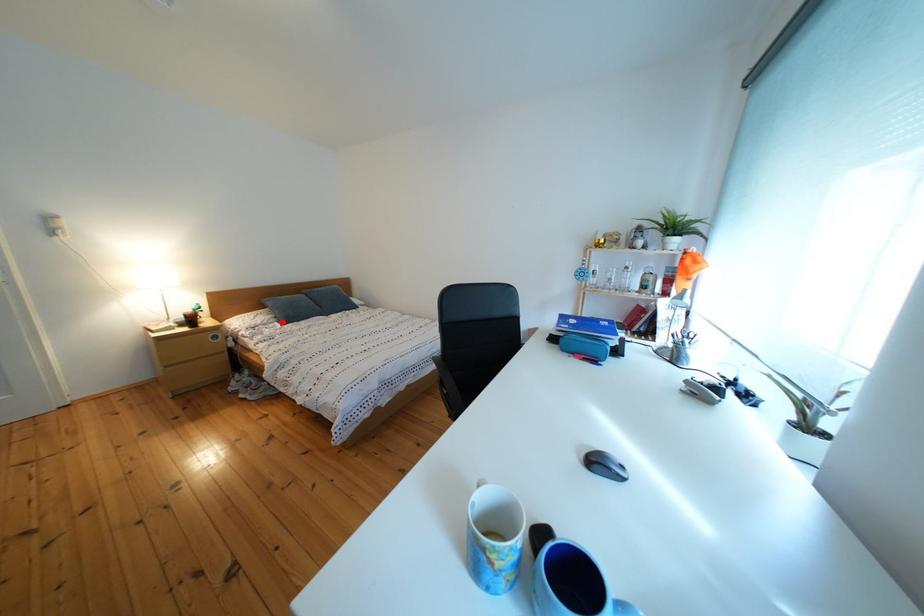
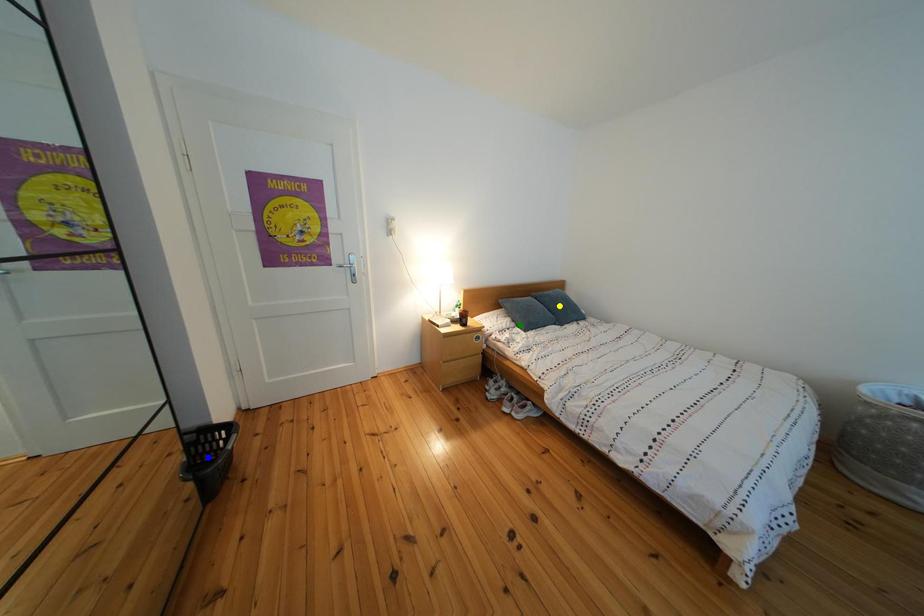
Question: I am providing you with two images of the same scene from different viewpoints. A red point is marked on the first image. You are given multiple points on the second image. Which point in image 2 is actually the same real-world point as the red point in image 1?

Choices:
 (A) yellow point
 (B) blue point
 (C) green point

Answer: (C)